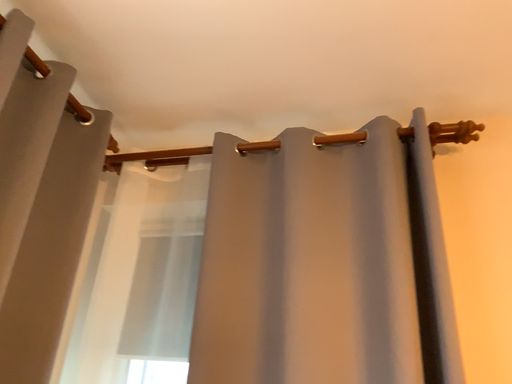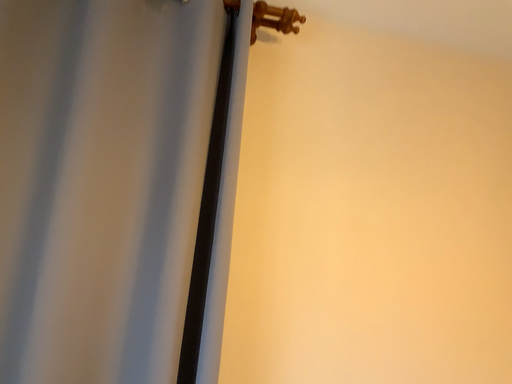
Question: How did the camera likely rotate when shooting the video?

Choices:
 (A) rotated right
 (B) rotated left

Answer: (A)